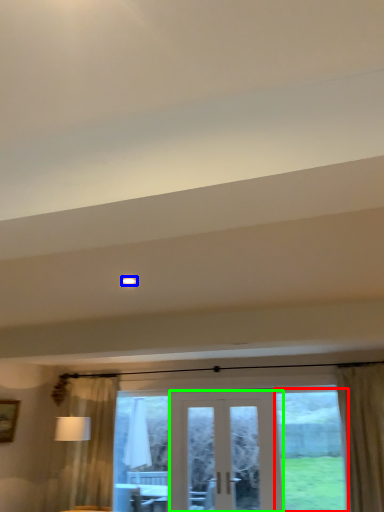
Question: Estimate the real-world distances between objects in this image. Which object is farther from window (highlighted by a red box), light (highlighted by a blue box) or door (highlighted by a green box)?

Choices:
 (A) light
 (B) door

Answer: (A)